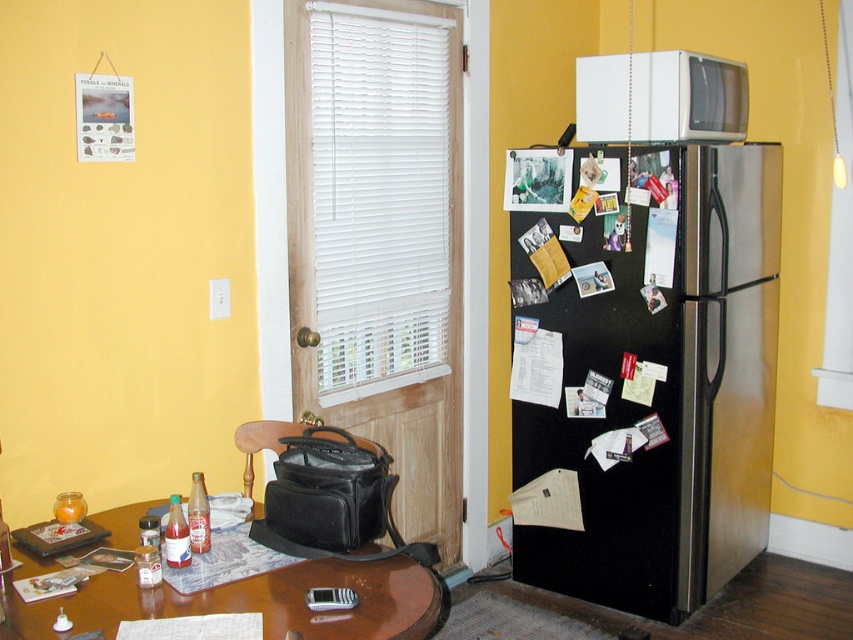
Question: Is black matte refrigerator at right below brown glossy table at lower left?

Choices:
 (A) no
 (B) yes

Answer: (A)

Question: Which of the following is the closest to the observer?

Choices:
 (A) (646, 509)
 (B) (741, 132)

Answer: (A)

Question: Does black matte refrigerator at right appear under white matte microwave at upper right?

Choices:
 (A) no
 (B) yes

Answer: (B)

Question: Based on their relative distances, which object is farther from the white matte microwave at upper right?

Choices:
 (A) black matte refrigerator at right
 (B) brown glossy table at lower left

Answer: (B)

Question: Which of the following is the farthest from the observer?

Choices:
 (A) brown glossy table at lower left
 (B) white matte microwave at upper right

Answer: (B)

Question: Can you confirm if black matte refrigerator at right is smaller than white matte microwave at upper right?

Choices:
 (A) no
 (B) yes

Answer: (A)